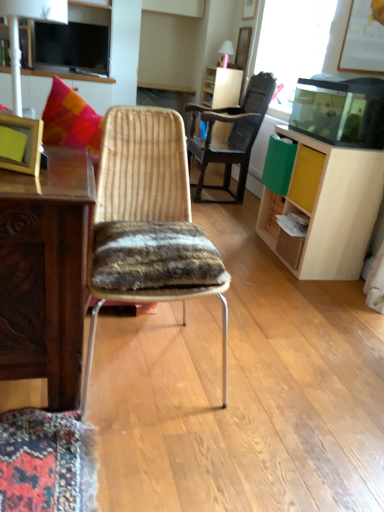
Where is `free space in front of woven wood chair at center, which is the second chair in back-to-front order`? free space in front of woven wood chair at center, which is the second chair in back-to-front order is located at coordinates (144, 457).